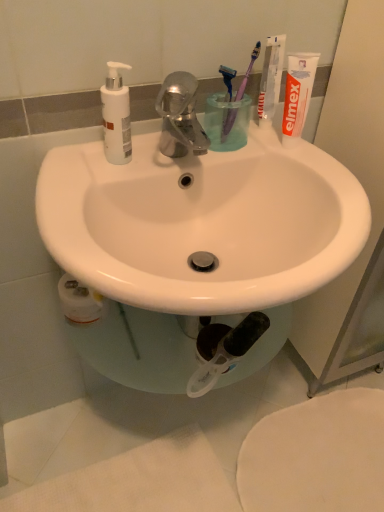
What are the coordinates of `free region on the left part of purple plastic toothbrush at upper right, positioned as the first toothbrush in left-to-right order` in the screenshot? It's located at (135, 152).